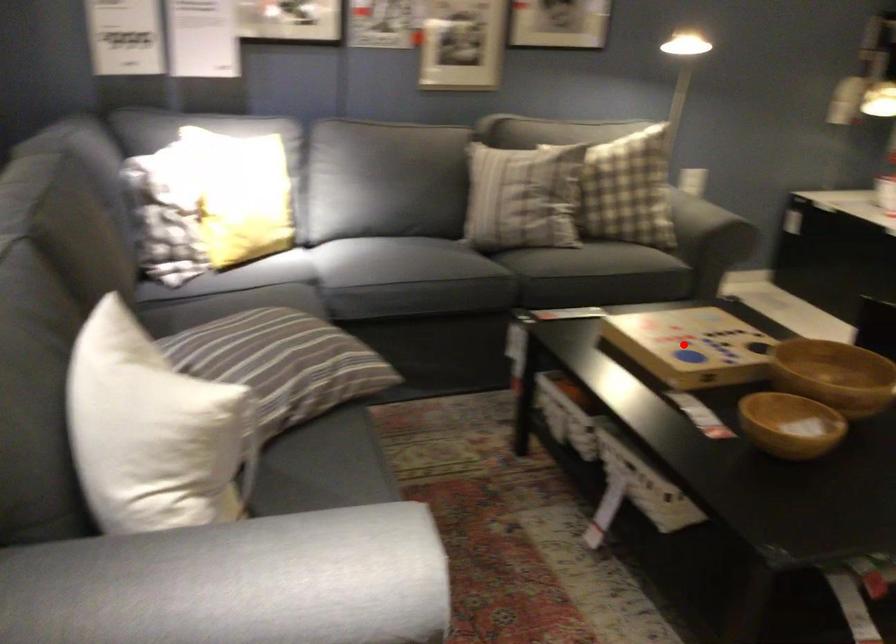
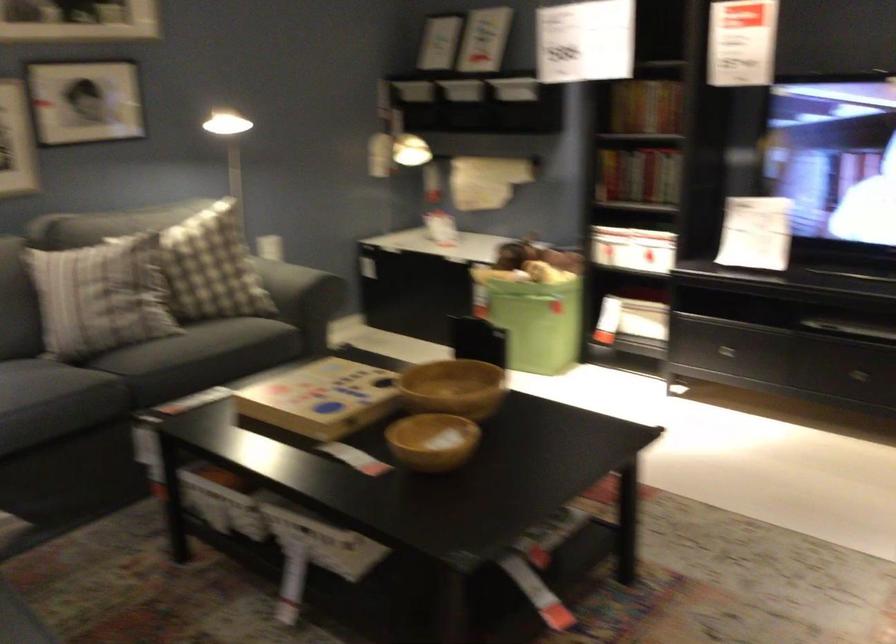
The point at the highlighted location is marked in the first image. Where is the corresponding point in the second image?

(320, 399)